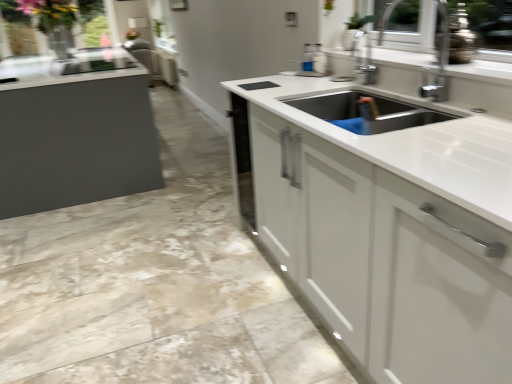
At what (x,y) coordinates should I click in order to perform the action: click on transparent glass window screen at upper left. Please return your answer as a coordinate pair (x, y). Looking at the image, I should click on (18, 29).

What do you see at coordinates (18, 29) in the screenshot?
I see `transparent glass window screen at upper left` at bounding box center [18, 29].

What do you see at coordinates (386, 221) in the screenshot? Image resolution: width=512 pixels, height=384 pixels. I see `white glossy countertop at center` at bounding box center [386, 221].

Measure the distance between point (376, 119) and camera.

1.36 meters.

The image size is (512, 384). Find the location of `white glossy countertop at center`. white glossy countertop at center is located at coordinates (386, 221).

This screenshot has height=384, width=512. In order to click on transparent glass window screen at upper left in this screenshot , I will do `click(18, 29)`.

Is white glossy countertop at center to the left or to the right of transparent glass window screen at upper left in the image?

white glossy countertop at center is to the right of transparent glass window screen at upper left.

Is white glossy countertop at center in front of or behind transparent glass window screen at upper left in the image?

white glossy countertop at center is positioned closer to the viewer than transparent glass window screen at upper left.

Does point (310, 297) come closer to viewer compared to point (13, 11)?

Yes, point (310, 297) is closer to viewer.

From the image's perspective, between white glossy countertop at center and transparent glass window screen at upper left, which one is located above?

From the image's view, transparent glass window screen at upper left is above.

From a real-world perspective, is white glossy countertop at center located higher than transparent glass window screen at upper left?

No, from a real-world perspective, white glossy countertop at center is not over transparent glass window screen at upper left

Which of these two, white glossy countertop at center or transparent glass window screen at upper left, is wider?

With larger width is white glossy countertop at center.

Considering the relative sizes of white glossy countertop at center and transparent glass window screen at upper left in the image provided, is white glossy countertop at center shorter than transparent glass window screen at upper left?

Yes.

Between white glossy countertop at center and transparent glass window screen at upper left, which one has smaller size?

Smaller between the two is transparent glass window screen at upper left.

From the picture: Is white glossy countertop at center located outside transparent glass window screen at upper left?

Indeed, white glossy countertop at center is completely outside transparent glass window screen at upper left.

Is white glossy countertop at center not close to transparent glass window screen at upper left?

Yes.

Is white glossy countertop at center oriented away from transparent glass window screen at upper left?

No, transparent glass window screen at upper left is not at the back of white glossy countertop at center.

You are a GUI agent. You are given a task and a screenshot of the screen. Output one action in this format:
    pyautogui.click(x=<x>, y=<y>)
    Task: Click on the window screen on the left of white glossy countertop at center
    
    Given the screenshot: What is the action you would take?
    pyautogui.click(x=18, y=29)

Is transparent glass window screen at upper left at the left side of white glossy countertop at center?

Yes, transparent glass window screen at upper left is to the left of white glossy countertop at center.

Consider the image. In the image, is transparent glass window screen at upper left positioned in front of or behind white glossy countertop at center?

Visually, transparent glass window screen at upper left is located behind white glossy countertop at center.

Does point (30, 39) come farther from viewer compared to point (303, 104)?

That is True.

From the image's perspective, which one is positioned higher, transparent glass window screen at upper left or white glossy countertop at center?

transparent glass window screen at upper left.

From a real-world perspective, which is physically above, transparent glass window screen at upper left or white glossy countertop at center?

transparent glass window screen at upper left.

Considering the sizes of objects transparent glass window screen at upper left and white glossy countertop at center in the image provided, who is thinner, transparent glass window screen at upper left or white glossy countertop at center?

With smaller width is transparent glass window screen at upper left.

Is transparent glass window screen at upper left taller or shorter than white glossy countertop at center?

In the image, transparent glass window screen at upper left appears to be taller than white glossy countertop at center.

Does transparent glass window screen at upper left have a smaller size compared to white glossy countertop at center?

Yes.

Would you say white glossy countertop at center is part of transparent glass window screen at upper left's contents?

Definitely not — white glossy countertop at center is not inside transparent glass window screen at upper left.

Is transparent glass window screen at upper left next to white glossy countertop at center?

transparent glass window screen at upper left and white glossy countertop at center are clearly separated.

Could you tell me if transparent glass window screen at upper left is turned towards white glossy countertop at center?

No, transparent glass window screen at upper left is not oriented towards white glossy countertop at center.

How many degrees apart are the facing directions of transparent glass window screen at upper left and white glossy countertop at center?

The facing directions of transparent glass window screen at upper left and white glossy countertop at center are 89.9 degrees apart.

How far apart are transparent glass window screen at upper left and white glossy countertop at center?

transparent glass window screen at upper left and white glossy countertop at center are 16.77 feet apart.

At what (x,y) coordinates should I click in order to perform the action: click on window screen above the white glossy countertop at center (from a real-world perspective). Please return your answer as a coordinate pair (x, y). Looking at the image, I should click on (18, 29).

You are a GUI agent. You are given a task and a screenshot of the screen. Output one action in this format:
    pyautogui.click(x=<x>, y=<y>)
    Task: Click on the window screen behind the white glossy countertop at center
    
    Given the screenshot: What is the action you would take?
    pyautogui.click(x=18, y=29)

Find the location of a particular element. This screenshot has width=512, height=384. countertop to the right of transparent glass window screen at upper left is located at coordinates (386, 221).